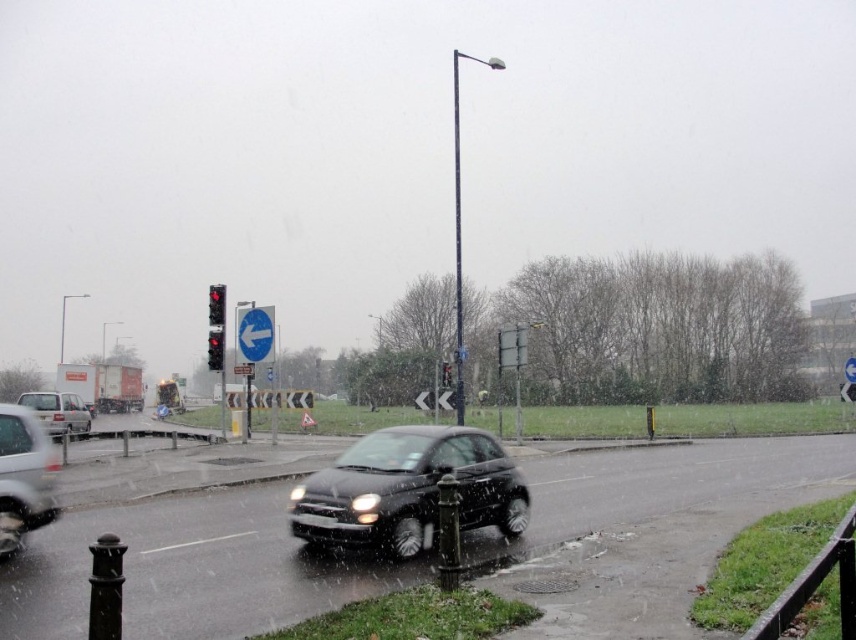
Who is lower down, white plastic sign at upper center or red glass traffic light at center?

Positioned lower is red glass traffic light at center.

At what (x,y) coordinates should I click in order to perform the action: click on white plastic sign at upper center. Please return your answer as a coordinate pair (x, y). Looking at the image, I should click on tap(254, 333).

Measure the distance between point (254, 320) and camera.

The distance of point (254, 320) from camera is 25.69 meters.

Where is `white plastic sign at upper center`? Image resolution: width=856 pixels, height=640 pixels. white plastic sign at upper center is located at coordinates (254, 333).

Is white glossy car at left further to the viewer compared to red glass traffic light at left?

No, it is not.

Between point (51, 488) and point (218, 326), which one is positioned in front?

Point (51, 488) is more forward.

The image size is (856, 640). What do you see at coordinates (24, 476) in the screenshot?
I see `white glossy car at left` at bounding box center [24, 476].

This screenshot has height=640, width=856. I want to click on white glossy car at left, so click(x=24, y=476).

Between white plastic sign at upper center and red glass traffic light at upper center, which one appears on the left side from the viewer's perspective?

From the viewer's perspective, red glass traffic light at upper center appears more on the left side.

Does white plastic sign at upper center lie in front of red glass traffic light at upper center?

That is True.

Which is behind, point (271, 326) or point (221, 323)?

The point (221, 323) is more distant.

Where is `white plastic sign at upper center`? The image size is (856, 640). white plastic sign at upper center is located at coordinates (254, 333).